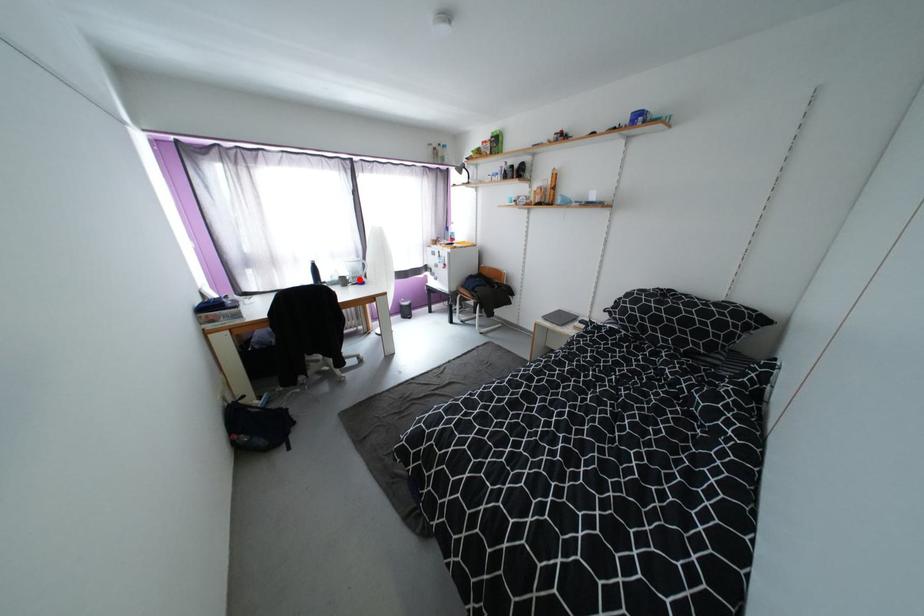
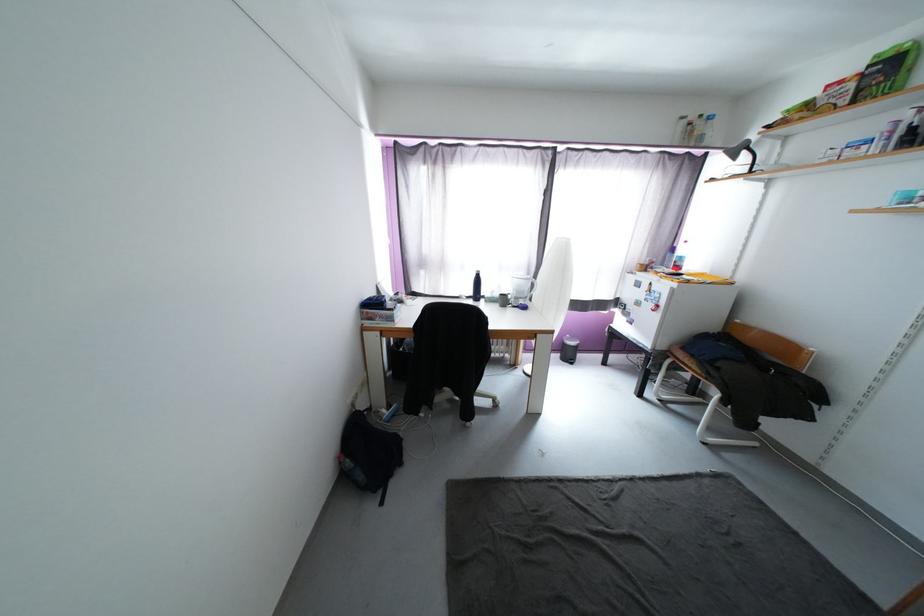
In the second image, find the point that corresponds to the highlighted location in the first image.

(521, 300)